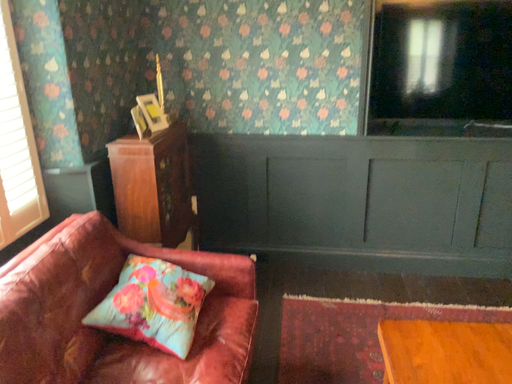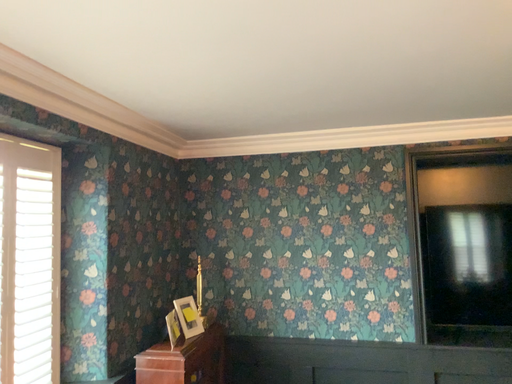
Question: Which way did the camera rotate in the video?

Choices:
 (A) rotated downward
 (B) rotated upward

Answer: (B)